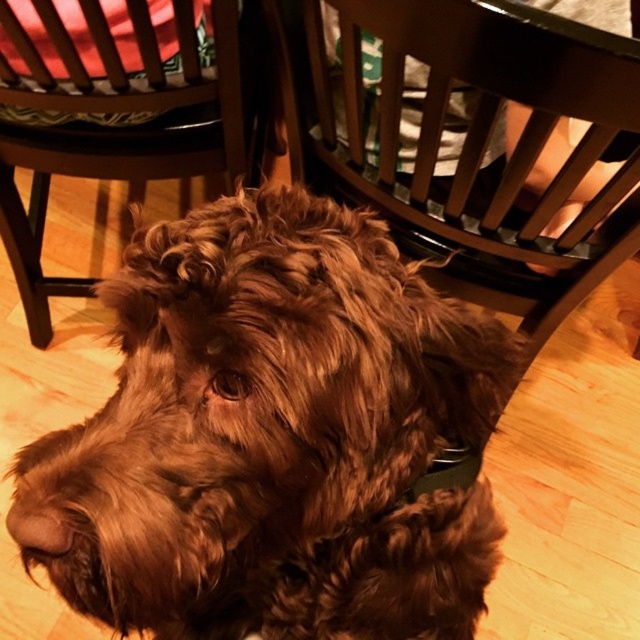
You are a photographer who wants to capture a closeup of the brown curly fur dog at center without including the wooden chair at upper left in the frame. Based on the current setup, do you think you can move closer to the dog to achieve this?

The brown curly fur dog at center is 25.00 inches from the wooden chair at upper left. Moving closer to the dog may bring the chair into the frame, so it might not be possible to exclude the wooden chair at upper left while maintaining the closeup.

You are trying to decide which wooden chair to place a small potted plant on. The wooden chair at center and the wooden chair at upper left are both options. Which chair has a wider seat to accommodate the plant?

The wooden chair at upper left has a greater width than the wooden chair at center, so it can accommodate the plant better.

You are a photographer trying to capture the brown curly fur dog at center and the wooden chair at center in a new shot. Based on their current positions, which object is closer to the left edge of the frame?

The brown curly fur dog at center is positioned on the left side of wooden chair at center, so it is closer to the left edge of the frame.